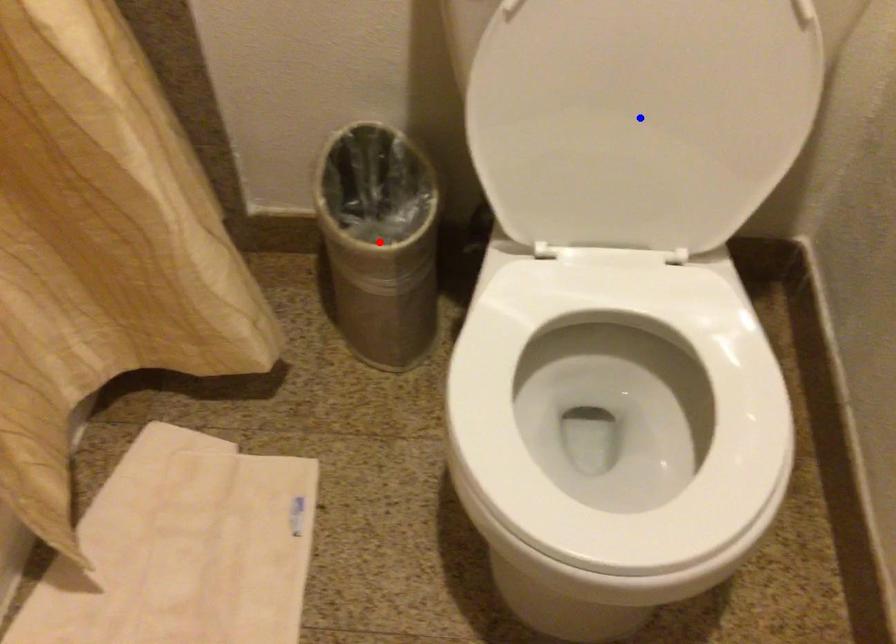
Question: In the image, two points are highlighted. Which point is nearer to the camera? Reply with the corresponding letter.

Choices:
 (A) blue point
 (B) red point

Answer: (A)